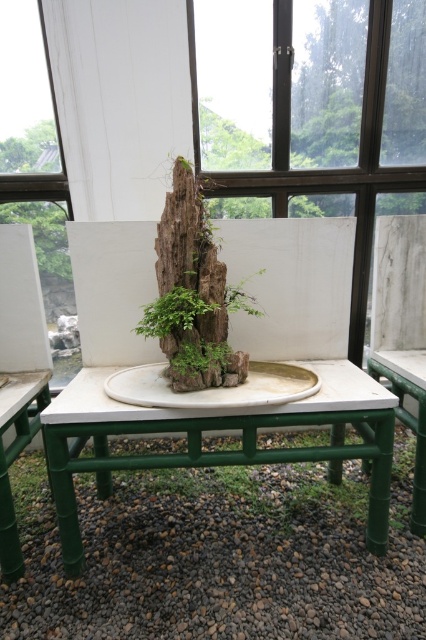
Which is behind, point (199, 440) or point (419, 464)?

The point (419, 464) is behind.

Does point (101, 381) come in front of point (405, 380)?

That is True.

Image resolution: width=426 pixels, height=640 pixels. I want to click on white matte table at center, so tap(218, 429).

Can you confirm if dark brown wood at upper center is positioned to the left of white matte table at center?

No, dark brown wood at upper center is not to the left of white matte table at center.

Is dark brown wood at upper center shorter than white matte table at center?

In fact, dark brown wood at upper center may be taller than white matte table at center.

Which is behind, point (290, 128) or point (374, 502)?

The point (290, 128) is behind.

Find the location of a particular element. This screenshot has height=640, width=426. dark brown wood at upper center is located at coordinates (307, 100).

Between dark brown wood at upper center and green bamboo table at center, which one is positioned higher?

Positioned higher is dark brown wood at upper center.

Does dark brown wood at upper center have a lesser height compared to green bamboo table at center?

In fact, dark brown wood at upper center may be taller than green bamboo table at center.

In order to click on dark brown wood at upper center in this screenshot , I will do `click(307, 100)`.